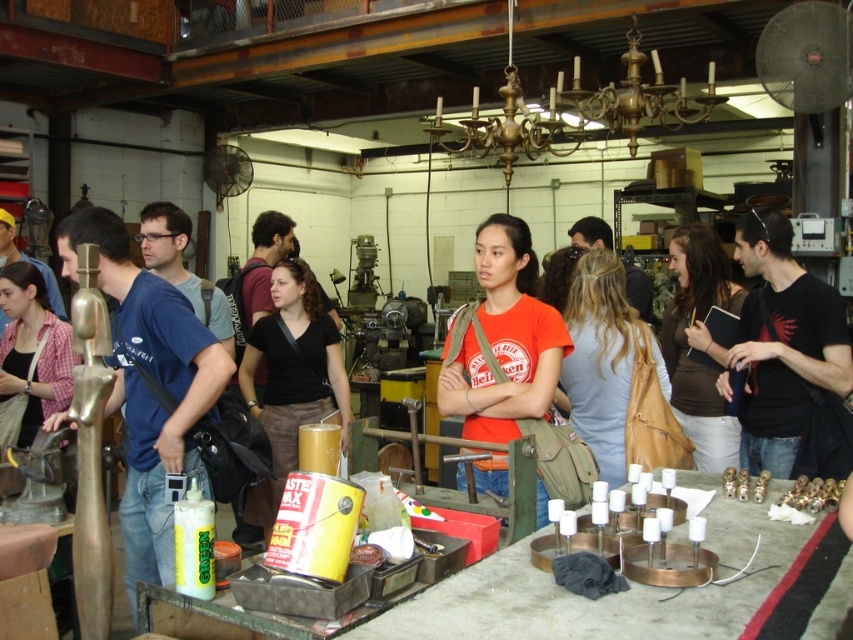
Question: Considering the real-world distances, which object is closest to the matte gold mannequin at left?

Choices:
 (A) plaid fabric shirt at center
 (B) brown leather jacket at center

Answer: (A)

Question: Considering the relative positions of black matte t-shirt at right and plaid fabric shirt at center in the image provided, where is black matte t-shirt at right located with respect to plaid fabric shirt at center?

Choices:
 (A) right
 (B) left

Answer: (A)

Question: Which of the following is the farthest from the observer?

Choices:
 (A) plaid fabric shirt at center
 (B) black matte shirt at center
 (C) light blue fabric at center
 (D) matte gold mannequin at left

Answer: (B)

Question: Among these objects, which one is nearest to the camera?

Choices:
 (A) plaid fabric shirt at center
 (B) brown leather jacket at center
 (C) light blue fabric at center
 (D) matte gold mannequin at left

Answer: (D)

Question: Can you confirm if matte gold mannequin at left is smaller than orange cotton shirt at center?

Choices:
 (A) no
 (B) yes

Answer: (A)

Question: Is light blue fabric at center smaller than black matte shirt at center?

Choices:
 (A) no
 (B) yes

Answer: (B)